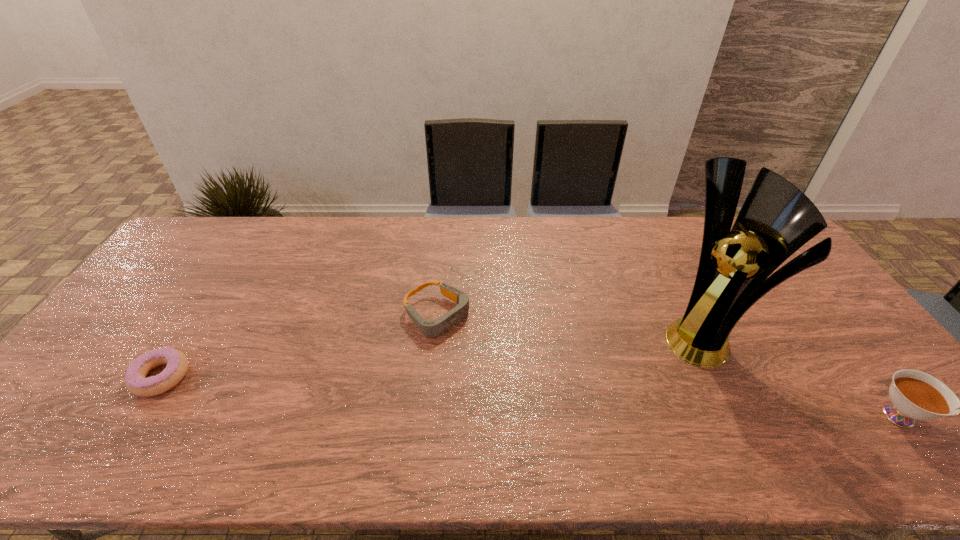
The width and height of the screenshot is (960, 540). In order to click on free space on the desktop that is between the doughnut and the third shortest object and is positioned at the front of the second object from right to left, where the globe is visible in this screenshot , I will do `click(626, 401)`.

The height and width of the screenshot is (540, 960). I want to click on free space on the desktop that is between the leftmost object and the rightmost object and is positioned on the front and back of the goggles, so click(543, 397).